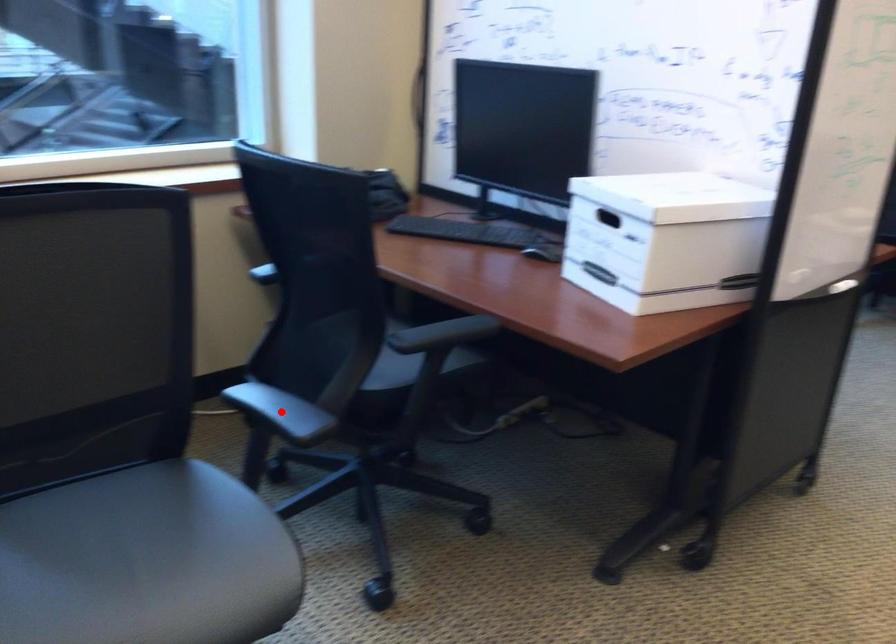
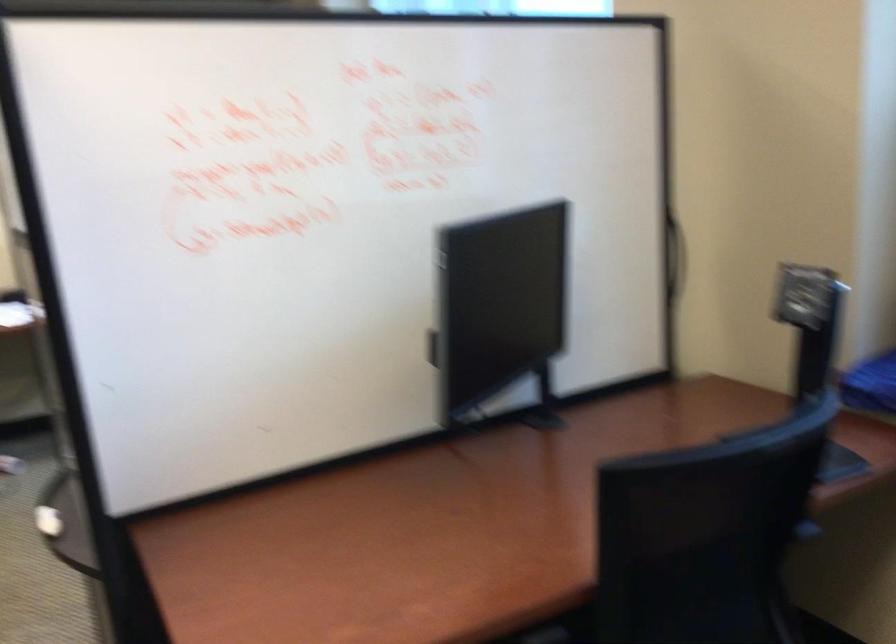
Question: I am providing you with two images of the same scene from different viewpoints. A red point is marked on the first image. Is the red point's position out of view in image 2?

Choices:
 (A) Yes
 (B) No

Answer: (A)